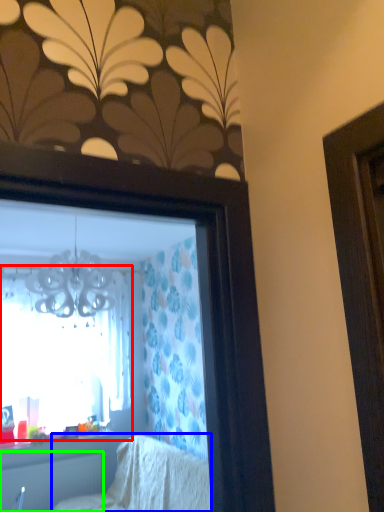
Question: Which object is positioned farthest from window (highlighted by a red box)? Select from furniture (highlighted by a blue box) and radiator (highlighted by a green box).

Choices:
 (A) furniture
 (B) radiator

Answer: (A)